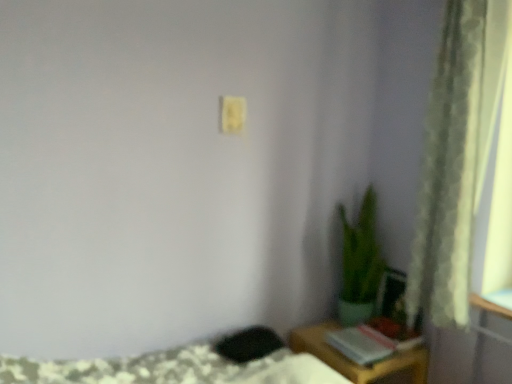
Locate an element on the screen. empty space that is ontop of wooden table at lower right (from a real-world perspective) is located at coordinates [349, 339].